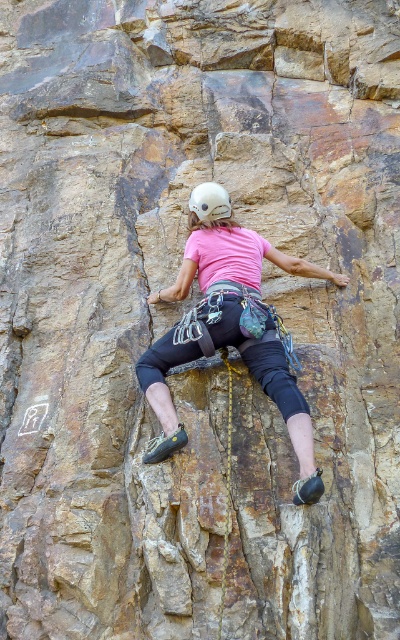
Is pink fabric shirt at center further to camera compared to white matte helmet at center?

That is False.

Which is more to the right, pink fabric shirt at center or white matte helmet at center?

Positioned to the right is pink fabric shirt at center.

Is point (174, 285) less distant than point (198, 193)?

No, it is not.

Where is `pink fabric shirt at center`? The width and height of the screenshot is (400, 640). pink fabric shirt at center is located at coordinates (231, 333).